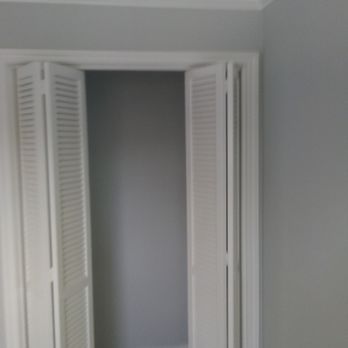
Where is `closet frame`? closet frame is located at coordinates (161, 67).